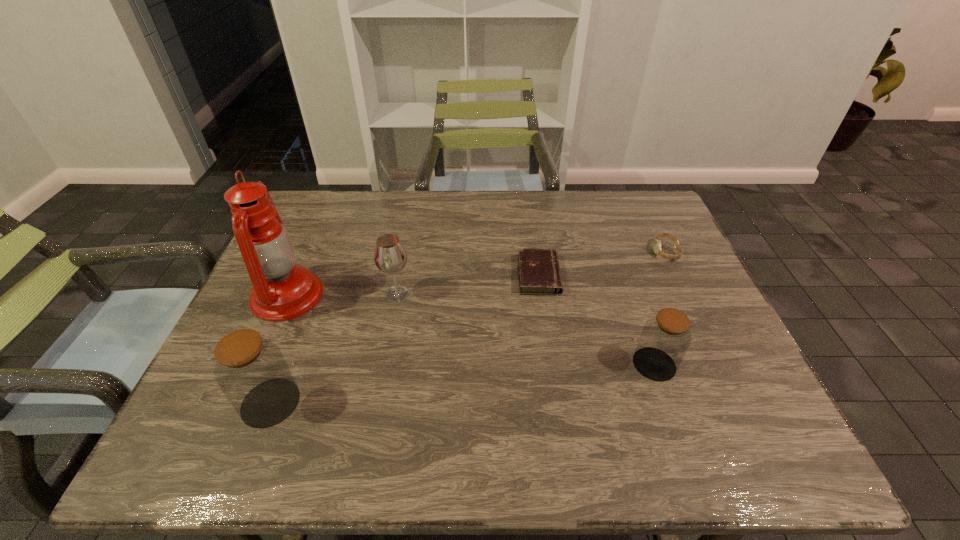
You are a GUI agent. You are given a task and a screenshot of the screen. Output one action in this format:
    pyautogui.click(x=<x>, y=<y>)
    Task: Click on the vacant position for inserting another jar evenly
    
    Given the screenshot: What is the action you would take?
    pyautogui.click(x=469, y=382)